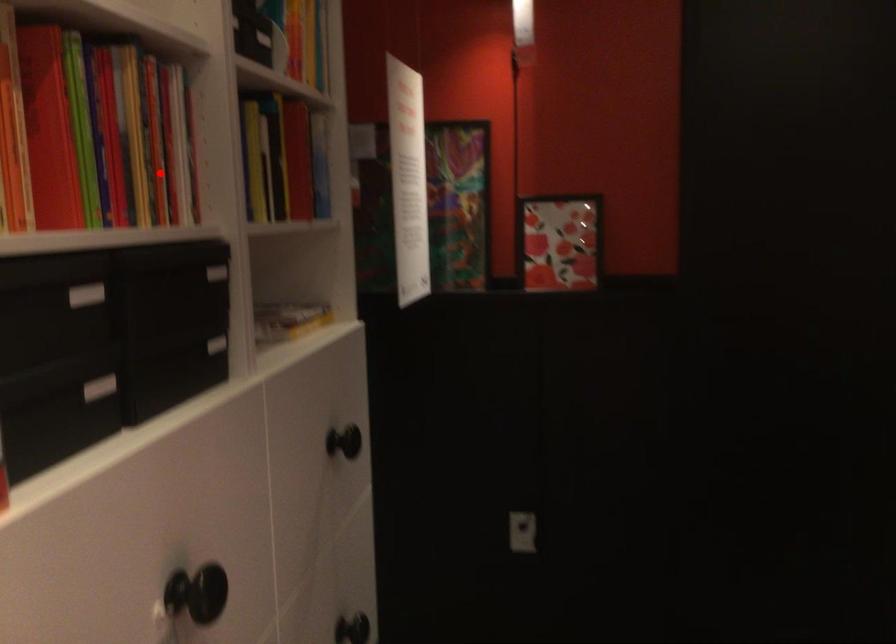
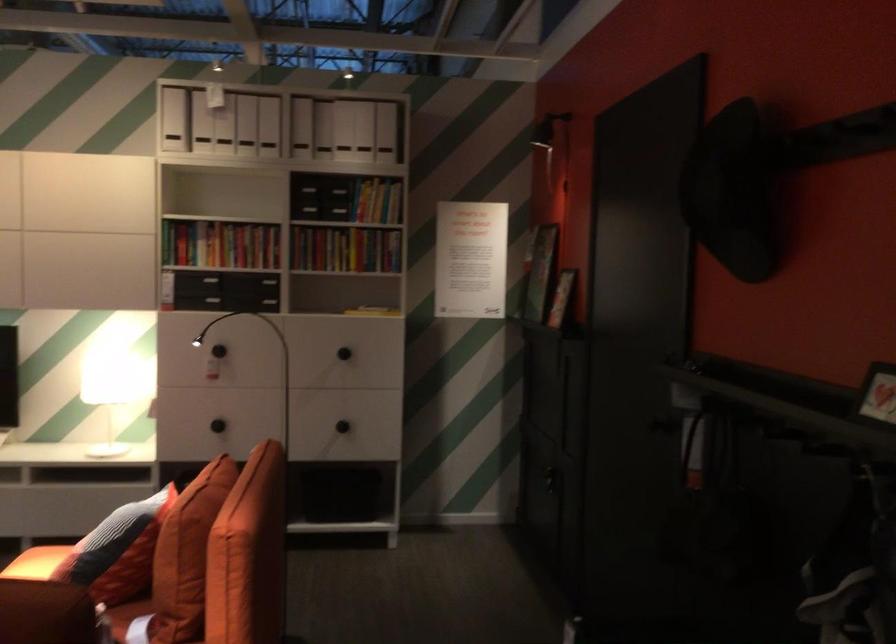
Question: I am providing you with two images of the same scene from different viewpoints. Image1 has a red point marked. In image2, the corresponding 3D location appears at what relative position? Reply with the corresponding letter.

Choices:
 (A) Closer
 (B) Farther

Answer: (B)